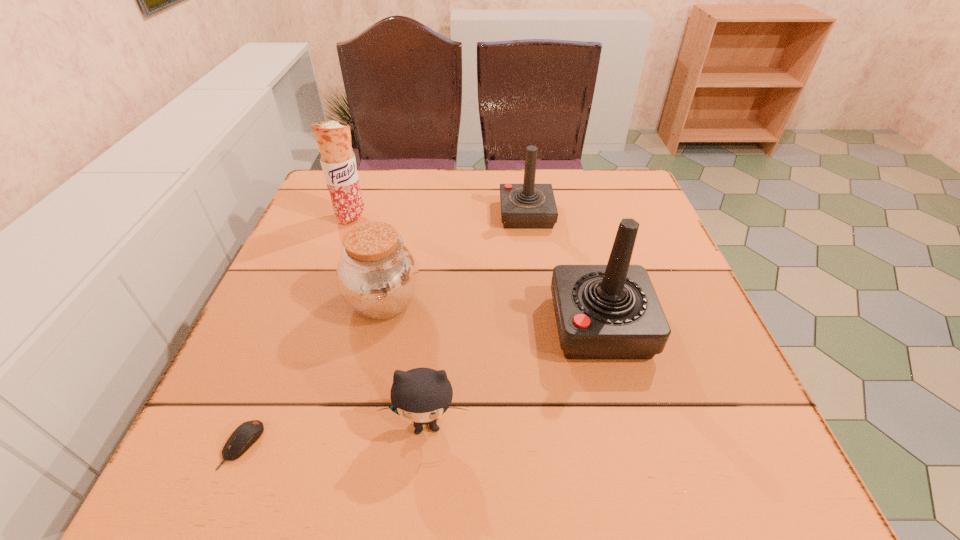
Identify the location of burrito. The width and height of the screenshot is (960, 540). (338, 162).

Image resolution: width=960 pixels, height=540 pixels. In order to click on the nearer joystick in this screenshot , I will do `click(611, 311)`.

You are a GUI agent. You are given a task and a screenshot of the screen. Output one action in this format:
    pyautogui.click(x=<x>, y=<y>)
    Task: Click on the farther joystick
    The height and width of the screenshot is (540, 960).
    Given the screenshot: What is the action you would take?
    pyautogui.click(x=523, y=206)

The height and width of the screenshot is (540, 960). In order to click on jar in this screenshot , I will do `click(377, 275)`.

At what (x,y) coordinates should I click in order to perform the action: click on kitten. Please return your answer as a coordinate pair (x, y). This screenshot has height=540, width=960. Looking at the image, I should click on (422, 395).

This screenshot has height=540, width=960. I want to click on the shortest object, so click(245, 435).

I want to click on vacant space situated 0.240m on the front of the burrito, so click(324, 295).

This screenshot has height=540, width=960. In order to click on free space located on the front-facing side of the taller joystick in this screenshot , I will do `click(502, 326)`.

This screenshot has width=960, height=540. I want to click on vacant area located on the front-facing side of the taller joystick, so click(x=461, y=326).

Where is `vacant position located 0.350m on the front-facing side of the taller joystick`? The width and height of the screenshot is (960, 540). vacant position located 0.350m on the front-facing side of the taller joystick is located at coordinates (373, 326).